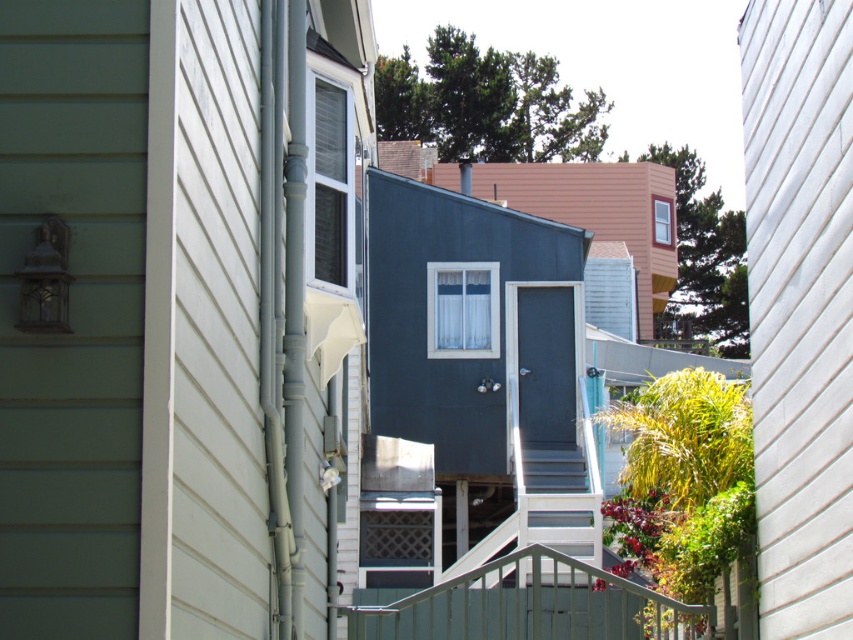
Which is more to the right, green painted wood siding at left or white painted wood siding at left?

From the viewer's perspective, white painted wood siding at left appears more on the right side.

Is point (97, 252) in front of point (234, 298)?

That is True.

What do you see at coordinates (71, 314) in the screenshot?
I see `green painted wood siding at left` at bounding box center [71, 314].

This screenshot has width=853, height=640. In order to click on green painted wood siding at left in this screenshot , I will do `click(71, 314)`.

Which is more to the left, green painted wood siding at left or white sheer curtain at center?

green painted wood siding at left is more to the left.

How far apart are green painted wood siding at left and white sheer curtain at center?

green painted wood siding at left is 21.58 meters away from white sheer curtain at center.

You are a GUI agent. You are given a task and a screenshot of the screen. Output one action in this format:
    pyautogui.click(x=<x>, y=<y>)
    Task: Click on the green painted wood siding at left
    Image resolution: width=853 pixels, height=640 pixels.
    Given the screenshot: What is the action you would take?
    pyautogui.click(x=71, y=314)

Looking at this image, is white painted wood siding at left above metallic gray balustrade at center?

Yes.

Is white painted wood siding at left smaller than metallic gray balustrade at center?

Correct, white painted wood siding at left occupies less space than metallic gray balustrade at center.

Which is in front, point (254, 246) or point (544, 554)?

Point (254, 246)

The image size is (853, 640). In order to click on white painted wood siding at left in this screenshot , I will do `click(202, 326)`.